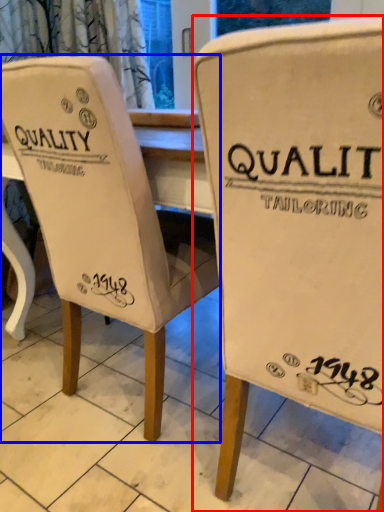
Question: Which object appears farthest to the camera in this image, chair (highlighted by a red box) or chair (highlighted by a blue box)?

Choices:
 (A) chair
 (B) chair

Answer: (B)